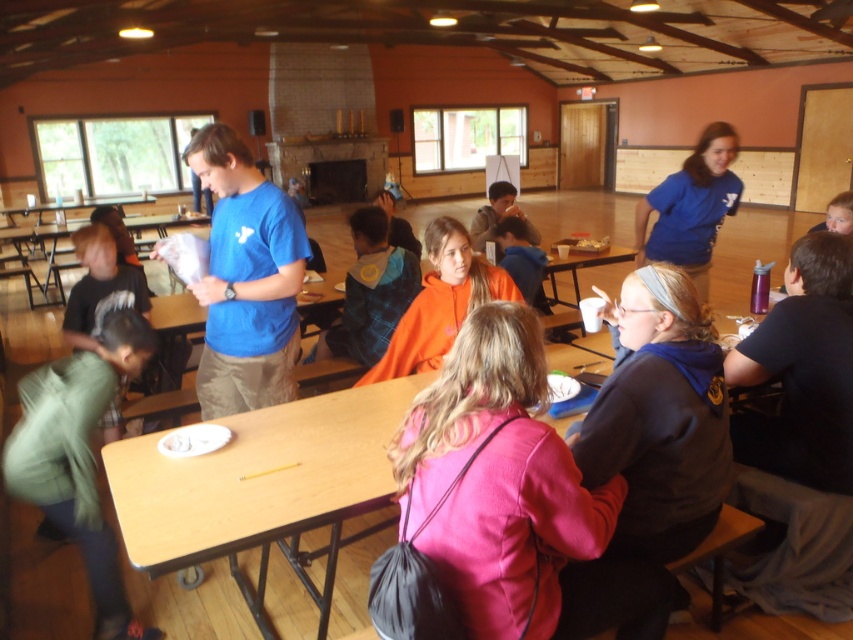
Does pink fabric jacket at center appear under wooden table at center?

No, pink fabric jacket at center is not below wooden table at center.

Who is higher up, pink fabric jacket at center or wooden table at center?

Positioned higher is pink fabric jacket at center.

Between point (474, 348) and point (187, 538), which one is positioned in front?

Point (474, 348) is in front.

Where is `pink fabric jacket at center`? pink fabric jacket at center is located at coordinates click(497, 481).

Can you confirm if green cotton pants at lower left is thinner than flannel shirt at center?

Correct, green cotton pants at lower left's width is less than flannel shirt at center's.

Based on the photo, does green cotton pants at lower left have a greater height compared to flannel shirt at center?

Correct, green cotton pants at lower left is much taller as flannel shirt at center.

Which is behind, point (47, 490) or point (349, 227)?

Point (349, 227)

You are a GUI agent. You are given a task and a screenshot of the screen. Output one action in this format:
    pyautogui.click(x=<x>, y=<y>)
    Task: Click on the green cotton pants at lower left
    This screenshot has width=853, height=640.
    Given the screenshot: What is the action you would take?
    pyautogui.click(x=79, y=451)

Is wooden table at center shorter than green cotton pants at lower left?

Indeed, wooden table at center has a lesser height compared to green cotton pants at lower left.

Who is more distant from viewer, (126, 468) or (109, 572)?

Point (109, 572)

Locate an element on the screen. wooden table at center is located at coordinates click(259, 486).